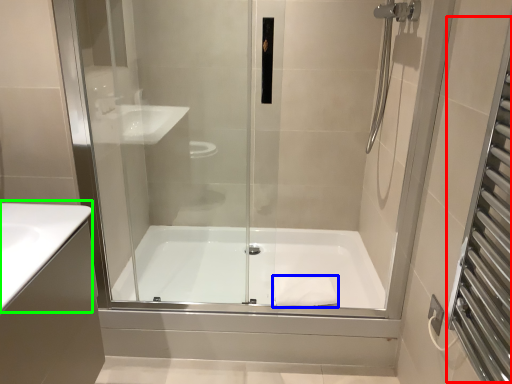
Question: Based on their relative distances, which object is farther from screen door (highlighted by a red box)? Choose from material (highlighted by a blue box) and counter top (highlighted by a green box).

Choices:
 (A) material
 (B) counter top

Answer: (B)